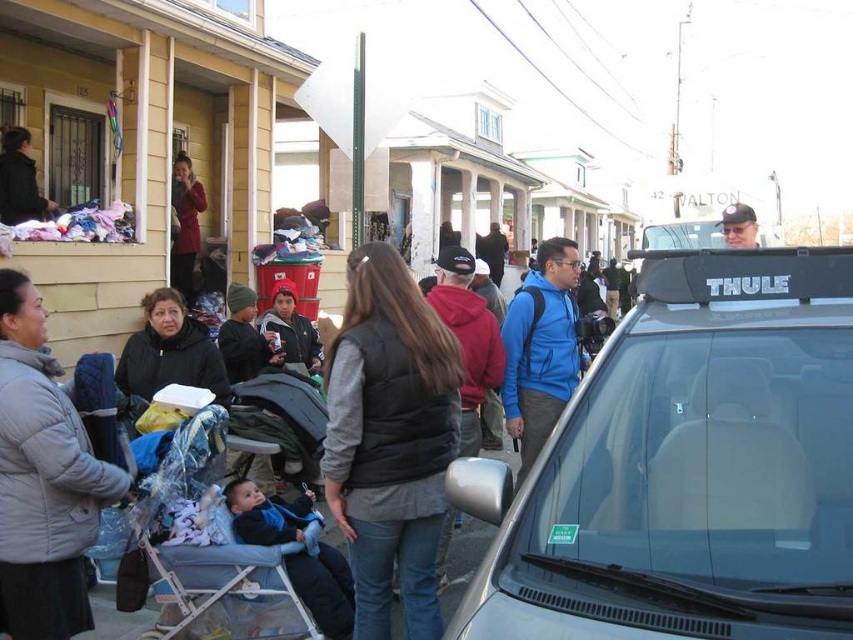
Image resolution: width=853 pixels, height=640 pixels. Describe the element at coordinates (467, 547) in the screenshot. I see `matte black stroller at lower left` at that location.

This screenshot has height=640, width=853. I want to click on matte black stroller at lower left, so click(467, 547).

At what (x,y) coordinates should I click in order to perform the action: click on matte black stroller at lower left. Please return your answer as a coordinate pair (x, y). Image resolution: width=853 pixels, height=640 pixels. Looking at the image, I should click on (467, 547).

Consider the image. Can you confirm if gray fabric baby carriage at lower left is taller than blue fabric baby carrier at lower left?

Correct, gray fabric baby carriage at lower left is much taller as blue fabric baby carrier at lower left.

Which is more to the left, gray fabric baby carriage at lower left or blue fabric baby carrier at lower left?

gray fabric baby carriage at lower left

This screenshot has height=640, width=853. What do you see at coordinates (215, 550) in the screenshot?
I see `gray fabric baby carriage at lower left` at bounding box center [215, 550].

Where is `gray fabric baby carriage at lower left`? This screenshot has height=640, width=853. gray fabric baby carriage at lower left is located at coordinates 215,550.

Which is more to the right, gray fabric baby carriage at lower left or blue matte jacket at center?

blue matte jacket at center is more to the right.

Measure the distance between point (196, 582) and camera.

The distance of point (196, 582) from camera is 3.89 meters.

I want to click on gray fabric baby carriage at lower left, so tap(215, 550).